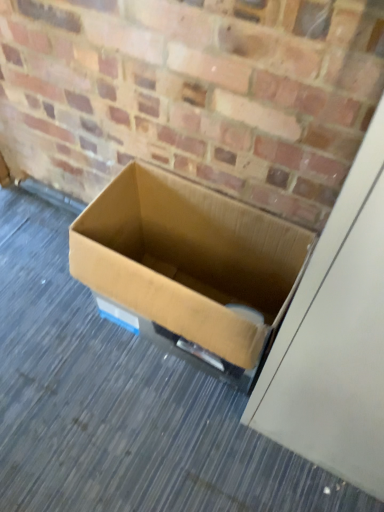
You are a GUI agent. You are given a task and a screenshot of the screen. Output one action in this format:
    pyautogui.click(x=<x>, y=<y>)
    Task: Click on the free spot to the left of brown cardboard box at center
    This screenshot has height=512, width=384.
    Given the screenshot: What is the action you would take?
    pyautogui.click(x=54, y=333)